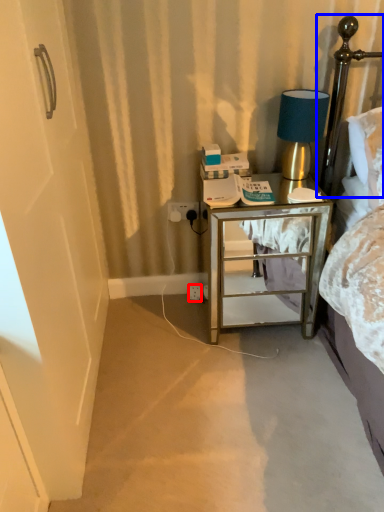
Question: Among these objects, which one is farthest to the camera, electric outlet (highlighted by a red box) or headboard (highlighted by a blue box)?

Choices:
 (A) electric outlet
 (B) headboard

Answer: (A)